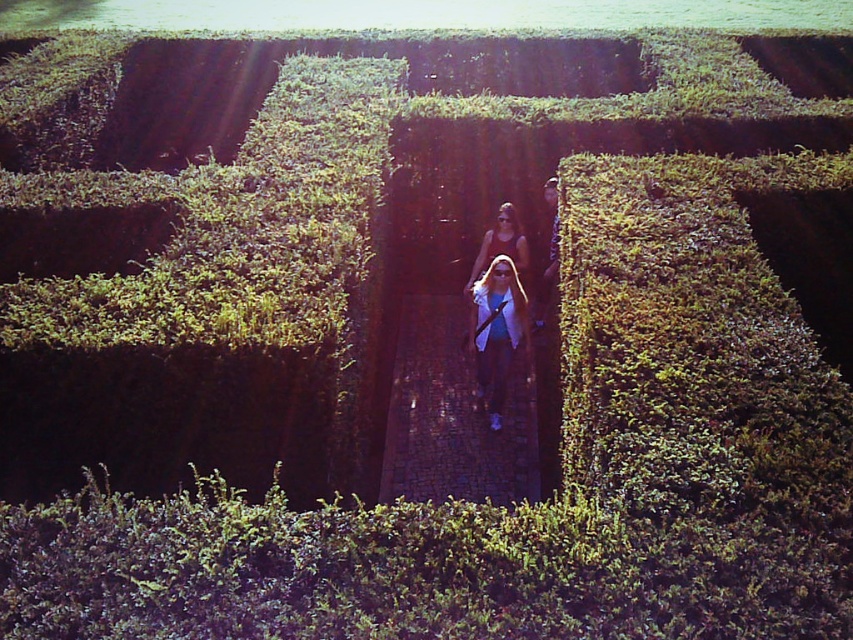
Is matte white jacket at center further to the viewer compared to matte black tank top at center?

That is False.

Find the location of a particular element. matte white jacket at center is located at coordinates (497, 330).